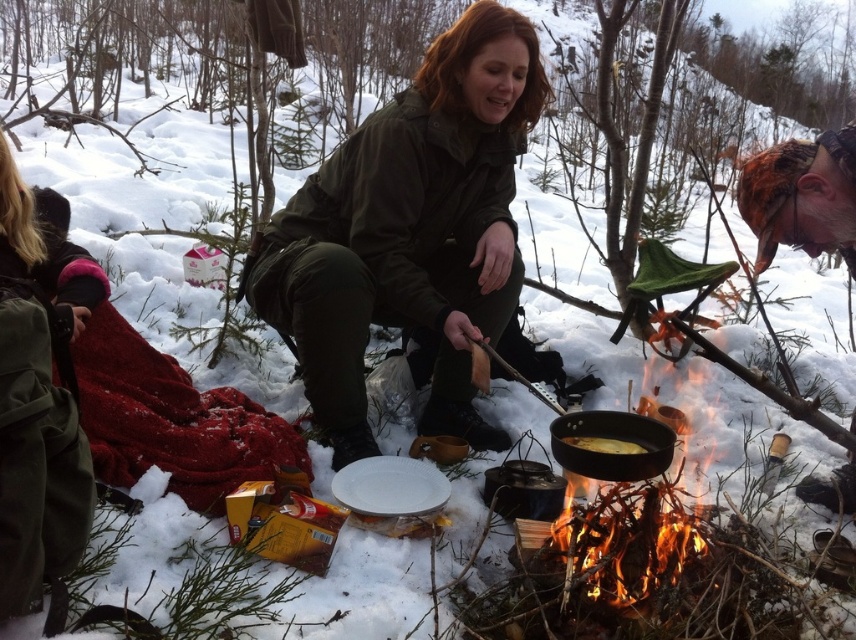
Does green matte jacket at center come behind golden crispy bread at center?

Yes, it is behind golden crispy bread at center.

Which is in front, point (428, 305) or point (581, 440)?

Point (581, 440) is more forward.

The width and height of the screenshot is (856, 640). In order to click on green matte jacket at center in this screenshot , I will do `click(409, 232)`.

Based on the photo, who is more forward, (x=321, y=360) or (x=111, y=422)?

Point (x=111, y=422) is more forward.

Describe the element at coordinates (409, 232) in the screenshot. I see `green matte jacket at center` at that location.

Which is in front, point (492, 236) or point (100, 449)?

Positioned in front is point (100, 449).

This screenshot has width=856, height=640. Find the location of `green matte jacket at center`. green matte jacket at center is located at coordinates (409, 232).

Who is positioned more to the left, red woolen blanket at lower left or shiny black pan at center?

red woolen blanket at lower left

What do you see at coordinates (171, 419) in the screenshot? I see `red woolen blanket at lower left` at bounding box center [171, 419].

Locate an element on the screen. red woolen blanket at lower left is located at coordinates (171, 419).